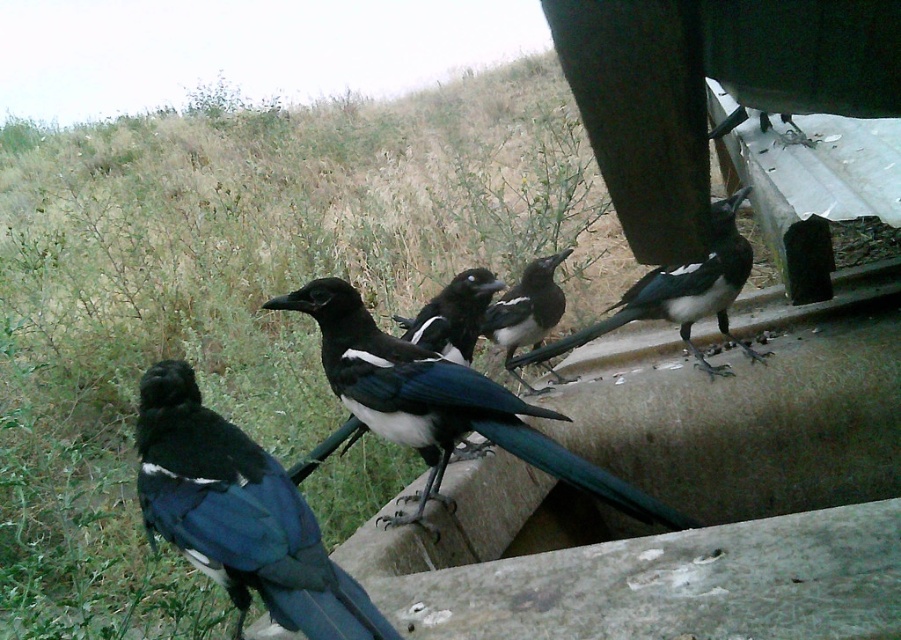
Question: Does matte black magpie at lower left appear under shiny black magpie at center?

Choices:
 (A) yes
 (B) no

Answer: (A)

Question: Which object is farther from the camera taking this photo?

Choices:
 (A) matte black magpie at lower left
 (B) shiny black magpie at upper right
 (C) shiny black magpie at center

Answer: (B)

Question: Does matte black magpie at lower left appear over shiny black magpie at center?

Choices:
 (A) yes
 (B) no

Answer: (B)

Question: Is matte black magpie at lower left below shiny black magpie at upper right?

Choices:
 (A) yes
 (B) no

Answer: (A)

Question: Which object is positioned closest to the shiny black magpie at center?

Choices:
 (A) matte black magpie at lower left
 (B) shiny black magpie at upper right

Answer: (A)

Question: Which of the following is the closest to the observer?

Choices:
 (A) (351, 593)
 (B) (686, 340)

Answer: (A)